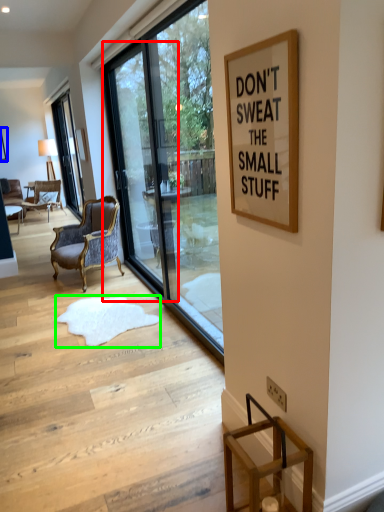
Question: Which object is the farthest from screen door (highlighted by a red box)? Choose among these: picture frame (highlighted by a blue box) or doormat (highlighted by a green box).

Choices:
 (A) picture frame
 (B) doormat

Answer: (A)